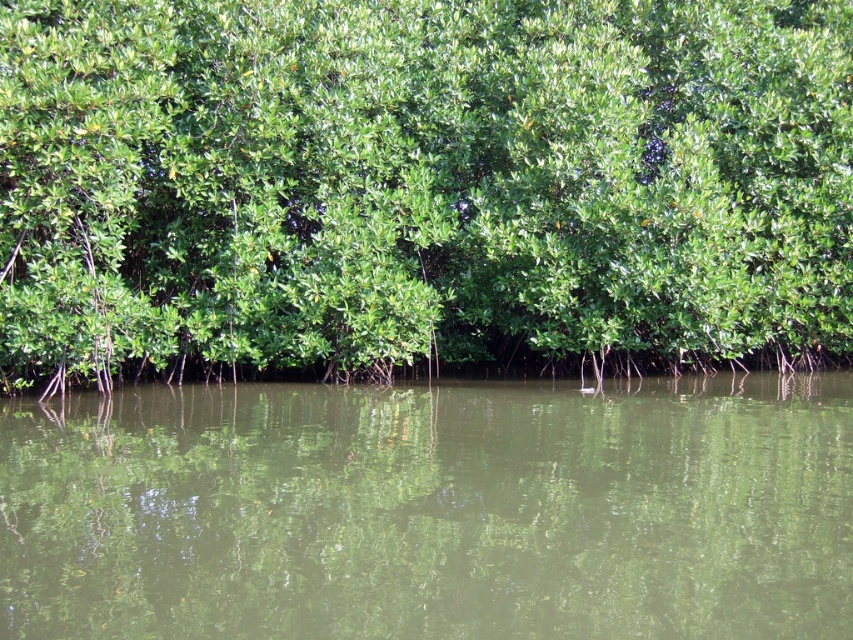
Question: Considering the relative positions of green leafy tree at center and green reflective water at center in the image provided, where is green leafy tree at center located with respect to green reflective water at center?

Choices:
 (A) right
 (B) left

Answer: (A)

Question: From the image, what is the correct spatial relationship of green leafy tree at center in relation to green reflective water at center?

Choices:
 (A) right
 (B) left

Answer: (A)

Question: Is green leafy tree at center above green reflective water at center?

Choices:
 (A) no
 (B) yes

Answer: (B)

Question: Among these objects, which one is nearest to the camera?

Choices:
 (A) green leafy tree at center
 (B) green reflective water at center

Answer: (B)